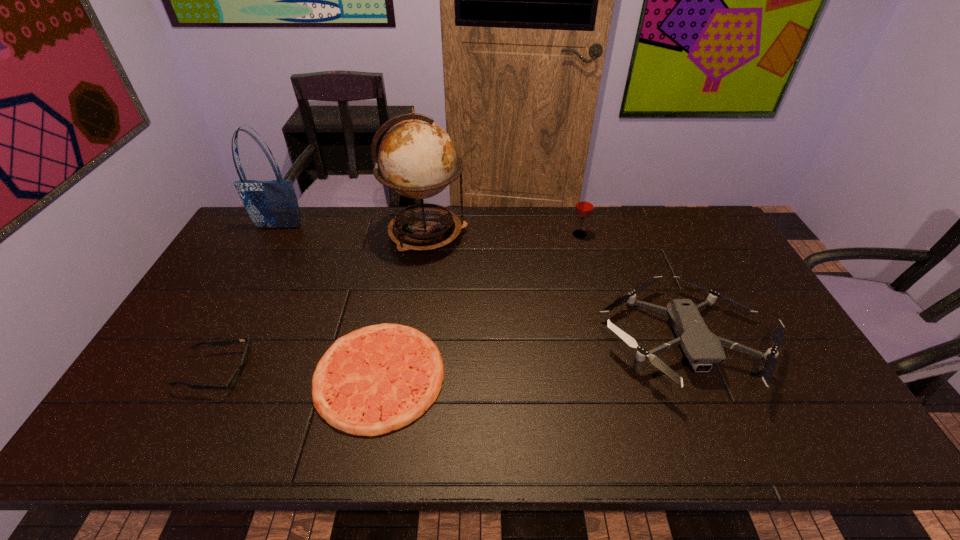
The height and width of the screenshot is (540, 960). Find the location of `vacant space at the far edge`. vacant space at the far edge is located at coordinates (675, 242).

The image size is (960, 540). Find the location of `free region at the near edge of the desktop`. free region at the near edge of the desktop is located at coordinates (487, 449).

The image size is (960, 540). In the image, there is a desktop. Find the location of `free region at the left edge`. free region at the left edge is located at coordinates tap(250, 271).

In the image, there is a desktop. Identify the location of vacant space at the far right corner. (691, 233).

Where is `free space between the third shortest object and the third tallest object`? The image size is (960, 540). free space between the third shortest object and the third tallest object is located at coordinates (632, 288).

Identify the location of free space that is in between the tallest object and the second tallest object. Image resolution: width=960 pixels, height=540 pixels. tap(353, 231).

This screenshot has height=540, width=960. I want to click on unoccupied position between the third shortest object and the shopping bag, so click(481, 285).

Where is `vacant space in between the tallest object and the drone`? The image size is (960, 540). vacant space in between the tallest object and the drone is located at coordinates (555, 288).

You are a GUI agent. You are given a task and a screenshot of the screen. Output one action in this format:
    pyautogui.click(x=<x>, y=<y>)
    Task: Click on the unoccupied position between the globe and the shopping bag
    The height and width of the screenshot is (540, 960).
    Given the screenshot: What is the action you would take?
    pyautogui.click(x=353, y=231)

Image resolution: width=960 pixels, height=540 pixels. Identify the location of vacant area that lies between the shortest object and the third tallest object. (479, 305).